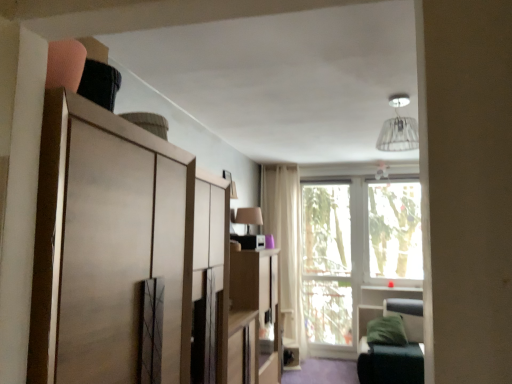
Where is `free spot above transparent glass window at center, which appears as the second window screen when viewed from the left (from a real-world perspective)`? free spot above transparent glass window at center, which appears as the second window screen when viewed from the left (from a real-world perspective) is located at coordinates (378, 162).